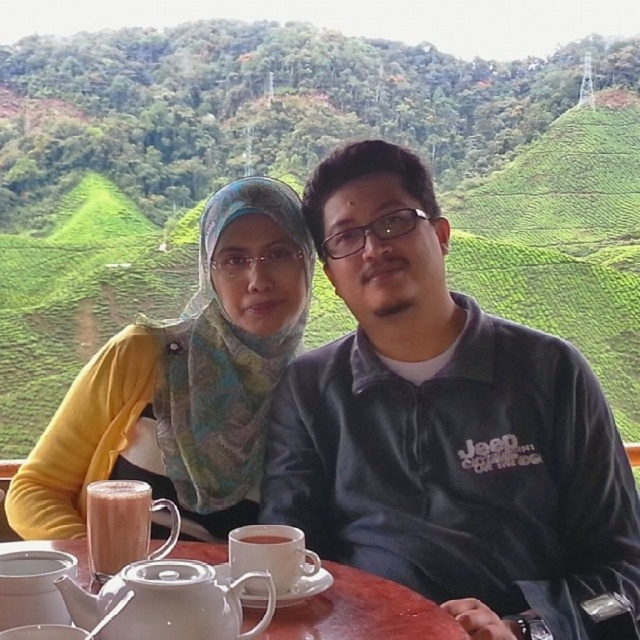
Question: Observing the image, what is the correct spatial positioning of green grassy hillside at upper center in reference to matte pink beverage at lower left?

Choices:
 (A) left
 (B) right

Answer: (A)

Question: Is white ceramic table at center smaller than white ceramic cup at center?

Choices:
 (A) yes
 (B) no

Answer: (B)

Question: Where is white ceramic cup at center located in relation to brown matte cup at center in the image?

Choices:
 (A) below
 (B) above

Answer: (A)

Question: Which of the following is the farthest from the observer?

Choices:
 (A) white ceramic cup at center
 (B) white ceramic saucer at center

Answer: (B)

Question: Which point is closer to the camera?

Choices:
 (A) matte pink beverage at lower left
 (B) yellow fabric hijab at upper left

Answer: (A)

Question: Which point is farther to the camera?

Choices:
 (A) white glossy teapot at lower center
 (B) white ceramic cup at center

Answer: (B)